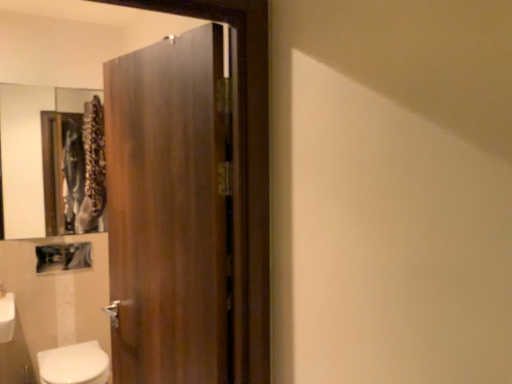
Question: Relative to wooden frame mirror at upper left, is white glossy bidet at lower left in front or behind?

Choices:
 (A) behind
 (B) front

Answer: (B)

Question: In the image, is white glossy bidet at lower left on the left side or the right side of wooden frame mirror at upper left?

Choices:
 (A) right
 (B) left

Answer: (A)

Question: Which is nearer to the wooden frame mirror at upper left?

Choices:
 (A) white glossy bidet at lower left
 (B) wooden door at center

Answer: (A)

Question: Which is farther from the white glossy bidet at lower left?

Choices:
 (A) wooden door at center
 (B) wooden frame mirror at upper left

Answer: (B)